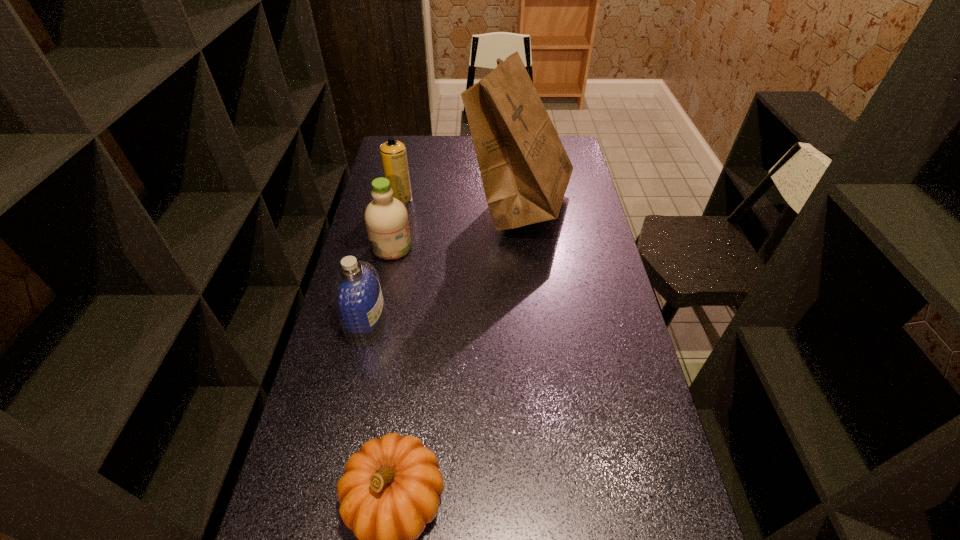
I want to click on free space that satisfies the following two spatial constraints: 1. on the back side of the nearer cleansing agent; 2. on the right side of the aerosol can, so click(395, 199).

Where is `blank area in the image that satisfies the following two spatial constraints: 1. on the front side of the aerosol can; 2. on the right side of the grocery bag`? The width and height of the screenshot is (960, 540). blank area in the image that satisfies the following two spatial constraints: 1. on the front side of the aerosol can; 2. on the right side of the grocery bag is located at coordinates (399, 204).